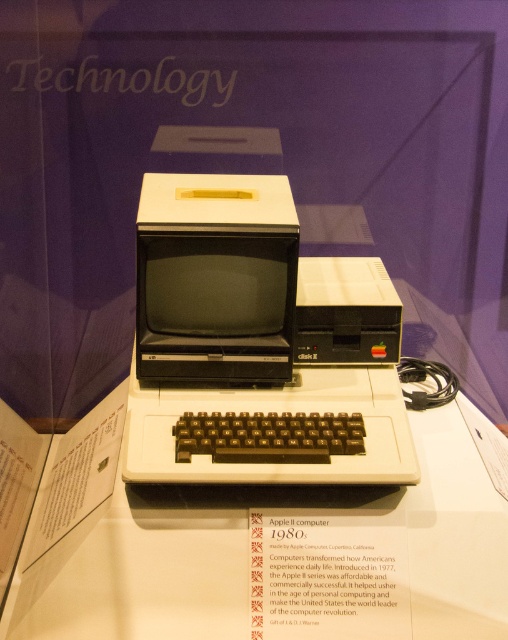
Is white plastic table at center positioned before black plastic keyboard at center?

Yes, it is.

Who is lower down, white plastic table at center or black plastic keyboard at center?

white plastic table at center is lower down.

Is point (262, 504) closer to viewer compared to point (306, 429)?

Yes.

Find the location of a particular element. white plastic table at center is located at coordinates (264, 532).

Between point (194, 179) and point (225, 428), which one is positioned in front?

Point (225, 428) is more forward.

In the scene shown: Between matte black monitor at center and black plastic keyboard at center, which one has less height?

black plastic keyboard at center

Is point (292, 214) closer to viewer compared to point (350, 432)?

No, it is not.

Where is `matte black monitor at center`? The width and height of the screenshot is (508, 640). matte black monitor at center is located at coordinates (215, 278).

Which is above, white plastic table at center or matte black monitor at center?

matte black monitor at center

From the picture: Does white plastic table at center appear over matte black monitor at center?

No.

Where is `white plastic table at center`? white plastic table at center is located at coordinates (264, 532).

Where is `white plastic table at center`? The height and width of the screenshot is (640, 508). white plastic table at center is located at coordinates (264, 532).